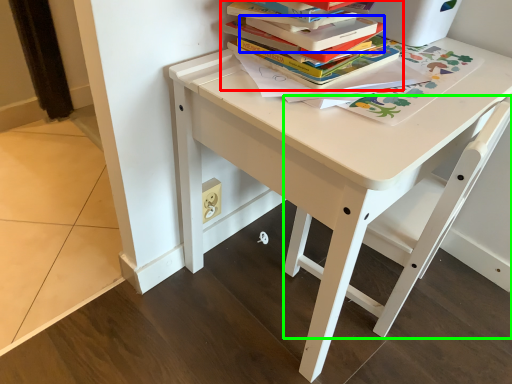
Question: Estimate the real-world distances between objects in this image. Which object is farther from book (highlighted by a red box), paperback book (highlighted by a blue box) or chair (highlighted by a green box)?

Choices:
 (A) paperback book
 (B) chair

Answer: (B)